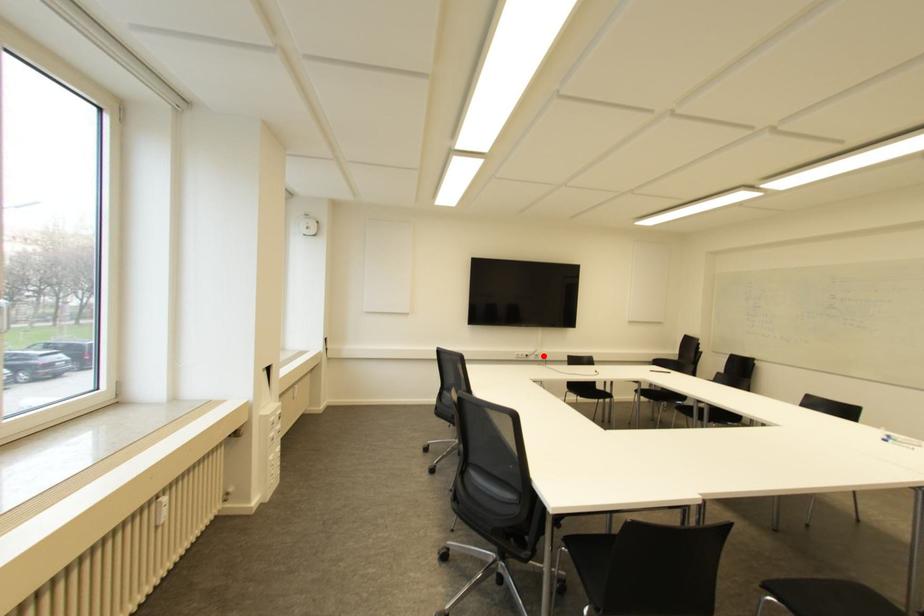
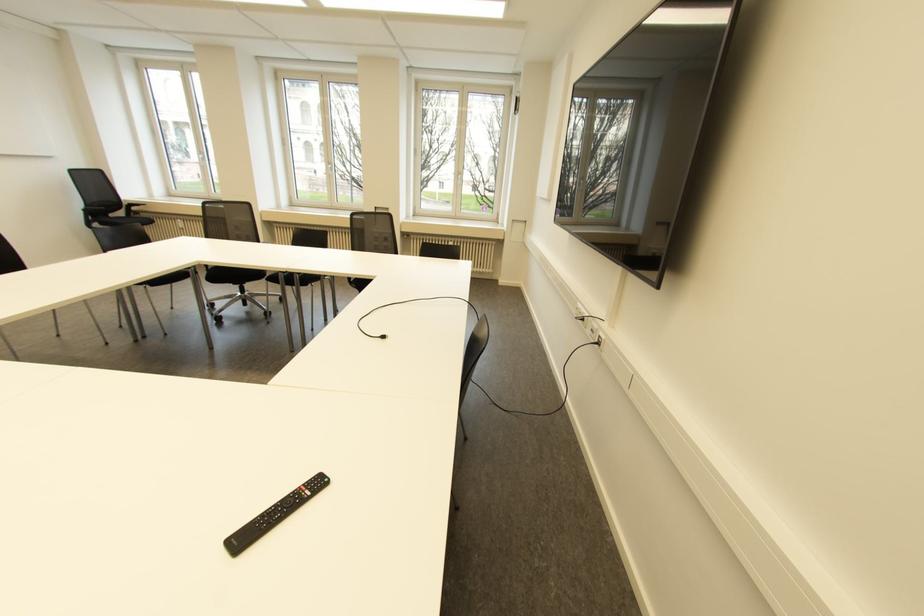
The point at the highlighted location is marked in the first image. Where is the corresponding point in the second image?

(598, 342)